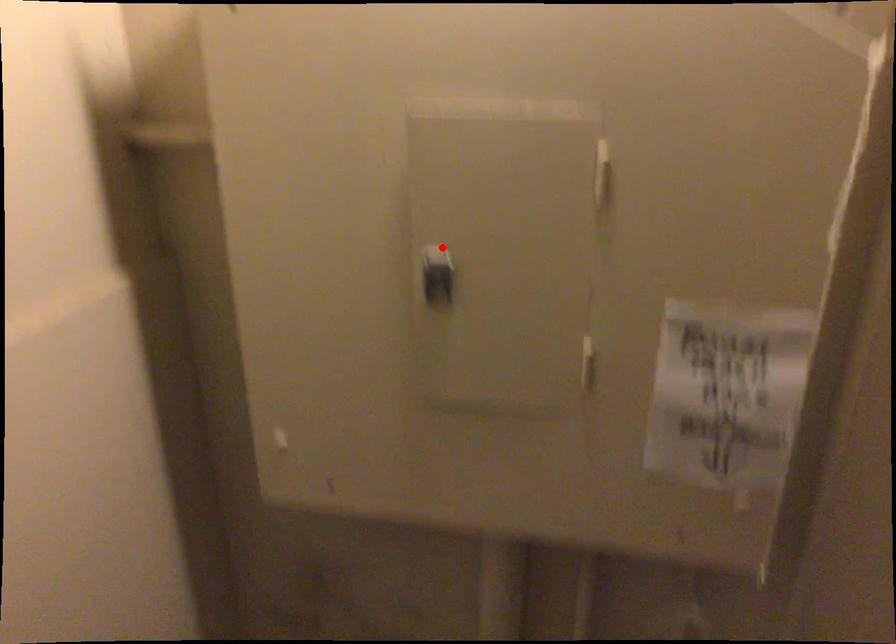
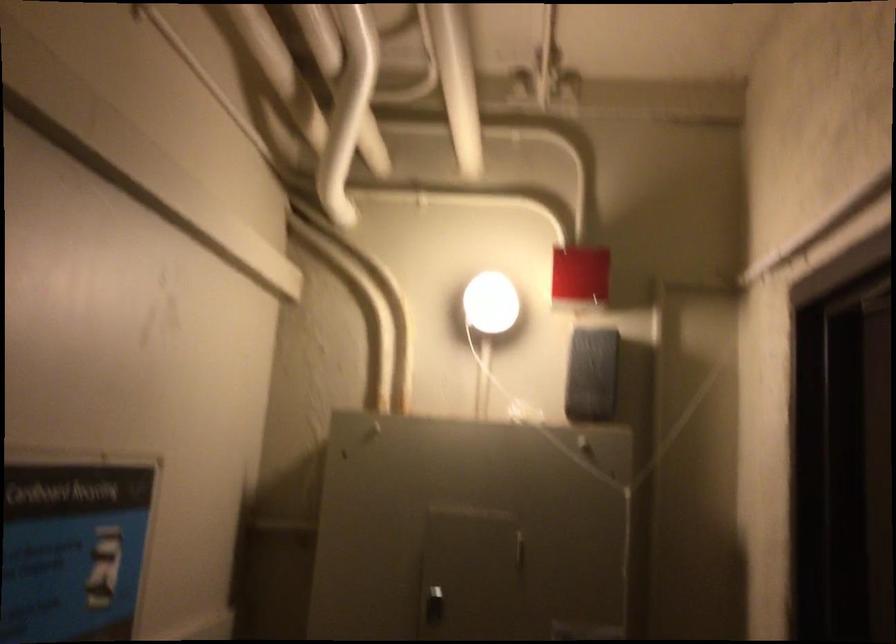
Locate, in the second image, the point that corresponds to the highlighted location in the first image.

(448, 578)